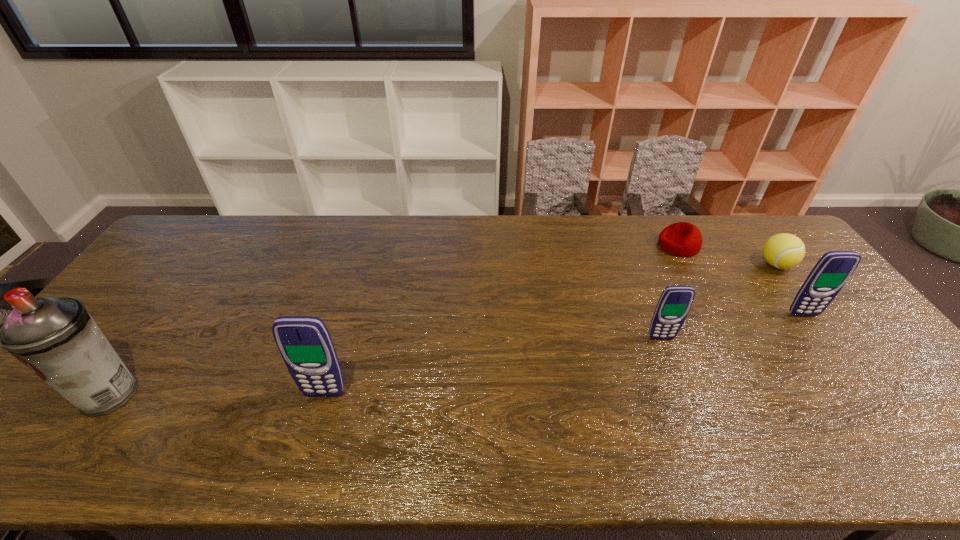
Where is `vacant area that lies between the tallest object and the farthest cellular telephone`? Image resolution: width=960 pixels, height=540 pixels. vacant area that lies between the tallest object and the farthest cellular telephone is located at coordinates pos(457,354).

Image resolution: width=960 pixels, height=540 pixels. I want to click on free space between the second shortest object and the fourth object from left to right, so click(x=727, y=255).

At what (x,y) coordinates should I click in order to perform the action: click on object that ranks as the fifth closest to the second farthest cellular telephone. Please return your answer as a coordinate pair (x, y). This screenshot has height=540, width=960. Looking at the image, I should click on (55, 337).

Where is `the closest object relative to the tennis ball`? the closest object relative to the tennis ball is located at coordinates (832, 271).

Where is `cellular telephone object that ranks as the closest to the tennis ball`? This screenshot has width=960, height=540. cellular telephone object that ranks as the closest to the tennis ball is located at coordinates (832, 271).

At what (x,y) coordinates should I click in order to perform the action: click on the second closest cellular telephone to the second object from left to right. Please return your answer as a coordinate pair (x, y). This screenshot has width=960, height=540. Looking at the image, I should click on (832, 271).

The width and height of the screenshot is (960, 540). Find the location of `vacant space that satisfies the following two spatial constraints: 1. on the seat area of the third object from right to left; 2. on the front-facing side of the third object from left to right`. vacant space that satisfies the following two spatial constraints: 1. on the seat area of the third object from right to left; 2. on the front-facing side of the third object from left to right is located at coordinates pyautogui.click(x=729, y=339).

At what (x,y) coordinates should I click in order to perform the action: click on free space that satisfies the following two spatial constraints: 1. on the seat area of the shortest object; 2. on the back side of the tennis ball. Please return your answer as a coordinate pair (x, y). This screenshot has width=960, height=540. Looking at the image, I should click on (688, 265).

Find the location of a particular element. vacant position in the image that satisfies the following two spatial constraints: 1. on the seat area of the shortest object; 2. on the front-facing side of the fourth object from right to left is located at coordinates (729, 339).